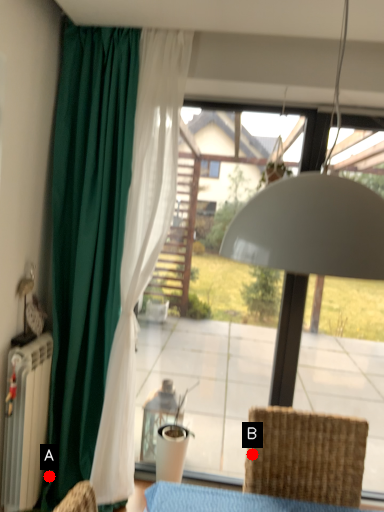
Question: Two points are circled on the image, labeled by A and B beside each circle. Which point is farther to the camera?

Choices:
 (A) A is further
 (B) B is further

Answer: (A)